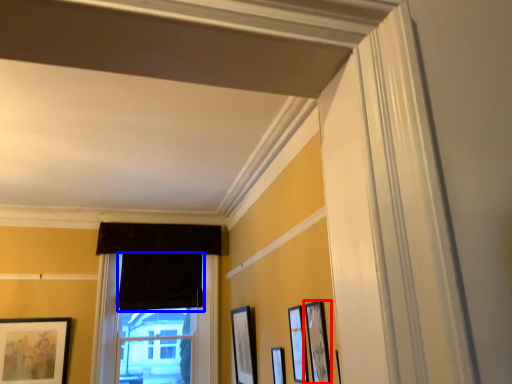
Question: Among these objects, which one is nearest to the camera, picture frame (highlighted by a red box) or curtain (highlighted by a blue box)?

Choices:
 (A) picture frame
 (B) curtain

Answer: (A)